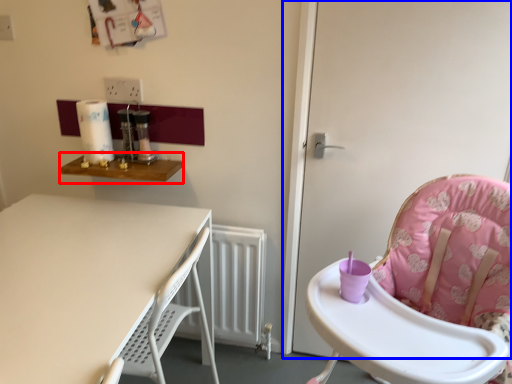
Question: Which object is closer to the camera taking this photo, table (highlighted by a red box) or screen door (highlighted by a blue box)?

Choices:
 (A) table
 (B) screen door

Answer: (B)